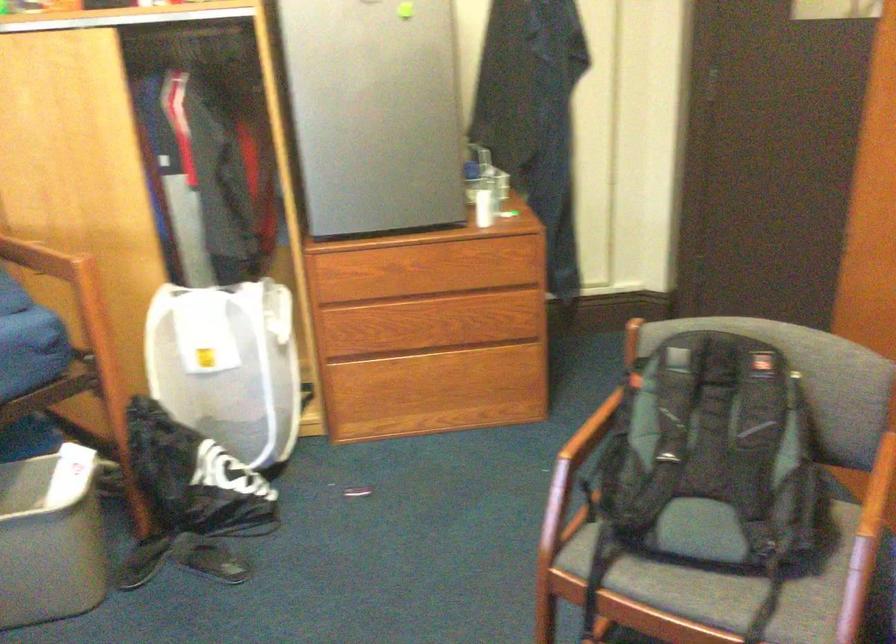
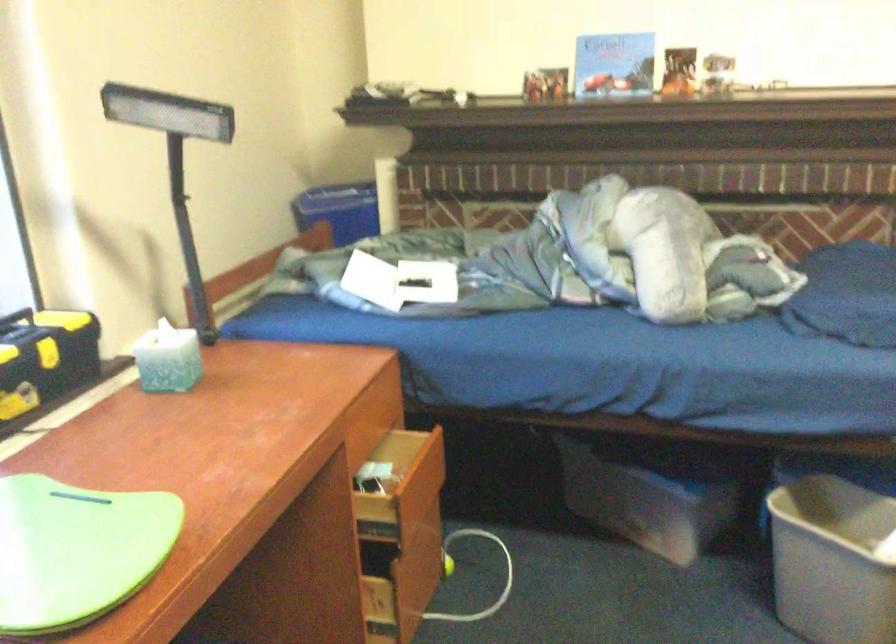
Question: Based on the continuous images, in which direction is the camera rotating? Reply with the corresponding letter.

Choices:
 (A) Left
 (B) Right
 (C) Up
 (D) Down

Answer: (A)